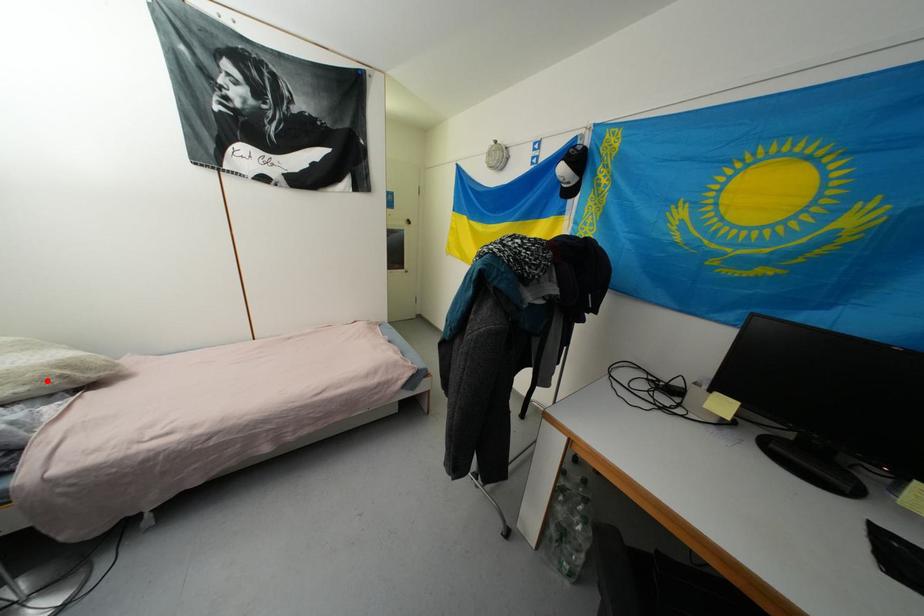
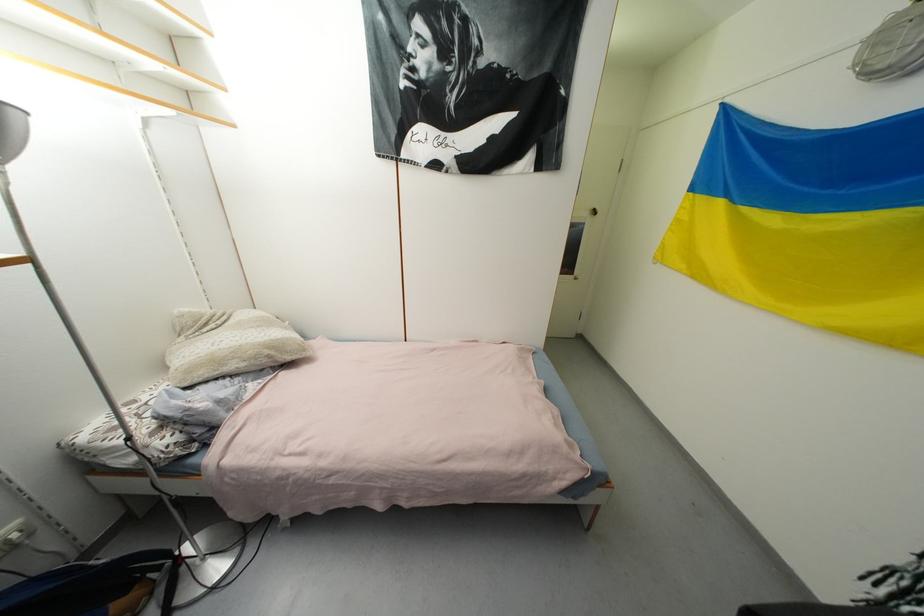
Question: I am providing you with two images of the same scene from different viewpoints. Given a red point in image1, look at the same physical point in image2. Is it:

Choices:
 (A) Closer to the viewpoint
 (B) Farther from the viewpoint

Answer: (A)